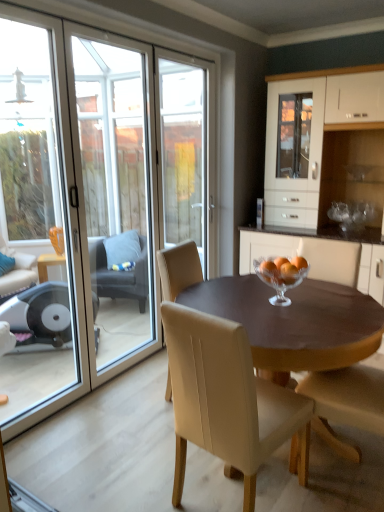
Question: Considering the positions of beige leather chair at center, which is the 2th chair in back-to-front order, and white glossy cabinet at center in the image, is beige leather chair at center, which is the 2th chair in back-to-front order, wider or thinner than white glossy cabinet at center?

Choices:
 (A) wide
 (B) thin

Answer: (B)

Question: Which is correct: beige leather chair at center, positioned as the 3th chair in front-to-back order, is inside white glossy cabinet at center, or outside of it?

Choices:
 (A) outside
 (B) inside

Answer: (A)

Question: Which object is the farthest from the transparent glass door at left?

Choices:
 (A) beige leather chair at center, which is the 4th chair from back to front
 (B) white glossy cabinet at center
 (C) beige leather chair at center, arranged as the third chair when viewed from the back
 (D) transparent glass screen door at left
 (E) beige leather chair at center, positioned as the 3th chair in front-to-back order

Answer: (C)

Question: Which is nearer to the beige leather chair at center, arranged as the 3th chair when viewed from the left?

Choices:
 (A) dark gray fabric chair at left, marked as the first chair in a back-to-front arrangement
 (B) beige leather chair at center, which is counted as the 2th chair, starting from the left
 (C) clear glass bowl at center
 (D) transparent glass screen door at left
 (E) wooden table at center

Answer: (E)